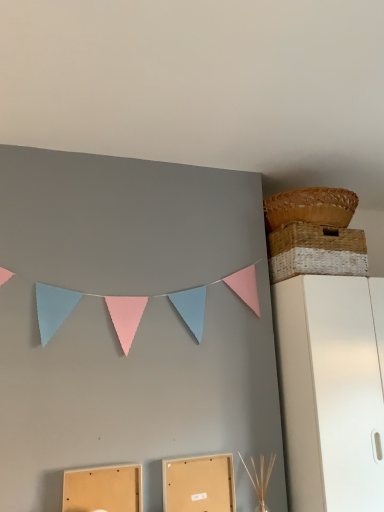
What do you see at coordinates (331, 390) in the screenshot?
I see `white matte cabinet at right` at bounding box center [331, 390].

This screenshot has height=512, width=384. Describe the element at coordinates (310, 207) in the screenshot. I see `woven brown basket at upper right, which appears as the first basket when viewed from the top` at that location.

Describe the element at coordinates (316, 251) in the screenshot. The width and height of the screenshot is (384, 512). I see `woven natural basket at upper right, the 2th basket when ordered from top to bottom` at that location.

At what (x,y) coordinates should I click in order to perform the action: click on white matte cabinet at right. Please return your answer as a coordinate pair (x, y). Looking at the image, I should click on (331, 390).

From a real-world perspective, is woven natural basket at upper right, the 2th basket when ordered from top to bottom, on top of matte cardboard box at lower center, which is the 1th cardboard box in left-to-right order?

Indeed, from a real-world perspective, woven natural basket at upper right, the 2th basket when ordered from top to bottom, stands above matte cardboard box at lower center, which is the 1th cardboard box in left-to-right order.

In terms of width, does woven natural basket at upper right, which is counted as the 1th basket, starting from the bottom, look wider or thinner when compared to matte cardboard box at lower center, the 2th cardboard box viewed from the right?

Considering their sizes, woven natural basket at upper right, which is counted as the 1th basket, starting from the bottom, looks broader than matte cardboard box at lower center, the 2th cardboard box viewed from the right.

The height and width of the screenshot is (512, 384). Identify the location of cardboard box that is the 2nd one when counting forward from the woven natural basket at upper right, which is counted as the 1th basket, starting from the bottom. (103, 489).

From the image's perspective, who appears lower, woven natural basket at upper right, the 2th basket when ordered from top to bottom, or matte cardboard box at lower center, the 2th cardboard box viewed from the right?

From the image's view, matte cardboard box at lower center, the 2th cardboard box viewed from the right, is below.

Where is `cardboard box that appears on the right of matte cardboard box at lower center, which is the 1th cardboard box in left-to-right order`? The image size is (384, 512). cardboard box that appears on the right of matte cardboard box at lower center, which is the 1th cardboard box in left-to-right order is located at coordinates (199, 484).

Which is more to the left, matte cardboard box at lower center, the 2th cardboard box viewed from the right, or matte cardboard box at lower center, positioned as the first cardboard box in right-to-left order?

Positioned to the left is matte cardboard box at lower center, the 2th cardboard box viewed from the right.

Is matte cardboard box at lower center, which is the 1th cardboard box in left-to-right order, next to matte cardboard box at lower center, positioned as the first cardboard box in right-to-left order, and touching it?

No, matte cardboard box at lower center, which is the 1th cardboard box in left-to-right order, is not with matte cardboard box at lower center, positioned as the first cardboard box in right-to-left order.

From a real-world perspective, is matte cardboard box at lower center, which is the 1th cardboard box in left-to-right order, on matte cardboard box at lower center, positioned as the second cardboard box in left-to-right order?

No.

From the picture: Is woven natural basket at upper right, which is counted as the 1th basket, starting from the bottom, turned away from matte cardboard box at lower center, positioned as the second cardboard box in left-to-right order?

No, woven natural basket at upper right, which is counted as the 1th basket, starting from the bottom, is not facing the opposite direction of matte cardboard box at lower center, positioned as the second cardboard box in left-to-right order.

Which object is thinner, woven natural basket at upper right, which is counted as the 1th basket, starting from the bottom, or matte cardboard box at lower center, positioned as the second cardboard box in left-to-right order?

matte cardboard box at lower center, positioned as the second cardboard box in left-to-right order.

Would you say woven natural basket at upper right, the 2th basket when ordered from top to bottom, contains matte cardboard box at lower center, positioned as the first cardboard box in right-to-left order?

Definitely not — matte cardboard box at lower center, positioned as the first cardboard box in right-to-left order, is not inside woven natural basket at upper right, the 2th basket when ordered from top to bottom.

Can you confirm if woven natural basket at upper right, which is counted as the 1th basket, starting from the bottom, is bigger than matte cardboard box at lower center, positioned as the second cardboard box in left-to-right order?

Yes, woven natural basket at upper right, which is counted as the 1th basket, starting from the bottom, is bigger than matte cardboard box at lower center, positioned as the second cardboard box in left-to-right order.

Is woven brown basket at upper right, which appears as the 2th basket when ordered from the bottom, oriented towards matte cardboard box at lower center, which is the 1th cardboard box in left-to-right order?

No, woven brown basket at upper right, which appears as the 2th basket when ordered from the bottom, is not facing towards matte cardboard box at lower center, which is the 1th cardboard box in left-to-right order.

Does point (311, 219) appear closer or farther from the camera than point (131, 473)?

Point (311, 219).

How different are the orientations of woven brown basket at upper right, which appears as the 2th basket when ordered from the bottom, and matte cardboard box at lower center, the 2th cardboard box viewed from the right, in degrees?

The angle between the facing direction of woven brown basket at upper right, which appears as the 2th basket when ordered from the bottom, and the facing direction of matte cardboard box at lower center, the 2th cardboard box viewed from the right, is 0.829 degrees.

Can matte cardboard box at lower center, which is the 1th cardboard box in left-to-right order, be found inside woven brown basket at upper right, which appears as the first basket when viewed from the top?

No, matte cardboard box at lower center, which is the 1th cardboard box in left-to-right order, is located outside of woven brown basket at upper right, which appears as the first basket when viewed from the top.

Considering the relative sizes of matte cardboard box at lower center, positioned as the second cardboard box in left-to-right order, and woven natural basket at upper right, the 2th basket when ordered from top to bottom, in the image provided, is matte cardboard box at lower center, positioned as the second cardboard box in left-to-right order, bigger than woven natural basket at upper right, the 2th basket when ordered from top to bottom,?

No.

Is matte cardboard box at lower center, positioned as the first cardboard box in right-to-left order, shorter than woven natural basket at upper right, which is counted as the 1th basket, starting from the bottom?

No.

Is matte cardboard box at lower center, positioned as the first cardboard box in right-to-left order, thinner than woven natural basket at upper right, which is counted as the 1th basket, starting from the bottom?

Yes.

Measure the distance between matte cardboard box at lower center, positioned as the second cardboard box in left-to-right order, and woven natural basket at upper right, which is counted as the 1th basket, starting from the bottom.

matte cardboard box at lower center, positioned as the second cardboard box in left-to-right order, and woven natural basket at upper right, which is counted as the 1th basket, starting from the bottom, are 33.90 inches apart.

How different are the orientations of woven brown basket at upper right, which appears as the 2th basket when ordered from the bottom, and woven natural basket at upper right, the 2th basket when ordered from top to bottom, in degrees?

The angular difference between woven brown basket at upper right, which appears as the 2th basket when ordered from the bottom, and woven natural basket at upper right, the 2th basket when ordered from top to bottom, is 6.12e-05 degrees.

Is woven brown basket at upper right, which appears as the 2th basket when ordered from the bottom, completely or partially outside of woven natural basket at upper right, which is counted as the 1th basket, starting from the bottom?

That's correct, woven brown basket at upper right, which appears as the 2th basket when ordered from the bottom, is outside of woven natural basket at upper right, which is counted as the 1th basket, starting from the bottom.

Identify the location of basket on the right side of woven brown basket at upper right, which appears as the first basket when viewed from the top. The width and height of the screenshot is (384, 512). (316, 251).

Considering the relative sizes of white matte cabinet at right and woven natural basket at upper right, the 2th basket when ordered from top to bottom, in the image provided, is white matte cabinet at right wider than woven natural basket at upper right, the 2th basket when ordered from top to bottom,?

Correct, the width of white matte cabinet at right exceeds that of woven natural basket at upper right, the 2th basket when ordered from top to bottom.

From the image's perspective, between white matte cabinet at right and woven natural basket at upper right, the 2th basket when ordered from top to bottom, which one is located above?

woven natural basket at upper right, the 2th basket when ordered from top to bottom.

Is white matte cabinet at right far away from woven natural basket at upper right, the 2th basket when ordered from top to bottom?

No, there isn't a large distance between white matte cabinet at right and woven natural basket at upper right, the 2th basket when ordered from top to bottom.

There is a matte cardboard box at lower center, the 2th cardboard box viewed from the right. Where is `the 1st basket above it (from the image's perspective)`? the 1st basket above it (from the image's perspective) is located at coordinates (316, 251).

I want to click on cardboard box below the matte cardboard box at lower center, positioned as the first cardboard box in right-to-left order (from a real-world perspective), so click(x=103, y=489).

Looking at the image, which one is located closer to matte cardboard box at lower center, positioned as the first cardboard box in right-to-left order, matte cardboard box at lower center, which is the 1th cardboard box in left-to-right order, or woven natural basket at upper right, which is counted as the 1th basket, starting from the bottom?

Based on the image, matte cardboard box at lower center, which is the 1th cardboard box in left-to-right order, appears to be nearer to matte cardboard box at lower center, positioned as the first cardboard box in right-to-left order.

Which object lies nearer to the anchor point matte cardboard box at lower center, the 2th cardboard box viewed from the right, woven natural basket at upper right, which is counted as the 1th basket, starting from the bottom, or matte cardboard box at lower center, positioned as the second cardboard box in left-to-right order?

matte cardboard box at lower center, positioned as the second cardboard box in left-to-right order, lies closer to matte cardboard box at lower center, the 2th cardboard box viewed from the right, than the other object.

From the image, which object appears to be nearer to white matte cabinet at right, matte cardboard box at lower center, the 2th cardboard box viewed from the right, or woven brown basket at upper right, which appears as the first basket when viewed from the top?

Among the two, woven brown basket at upper right, which appears as the first basket when viewed from the top, is located nearer to white matte cabinet at right.

Considering their positions, is white matte cabinet at right positioned closer to woven brown basket at upper right, which appears as the first basket when viewed from the top, than matte cardboard box at lower center, positioned as the first cardboard box in right-to-left order?

white matte cabinet at right lies closer to woven brown basket at upper right, which appears as the first basket when viewed from the top, than the other object.

Looking at this image, from the image, which object appears to be farther from woven brown basket at upper right, which appears as the 2th basket when ordered from the bottom, matte cardboard box at lower center, positioned as the second cardboard box in left-to-right order, or woven natural basket at upper right, which is counted as the 1th basket, starting from the bottom?

matte cardboard box at lower center, positioned as the second cardboard box in left-to-right order, is positioned further to the anchor woven brown basket at upper right, which appears as the 2th basket when ordered from the bottom.

Looking at the image, which one is located closer to white matte cabinet at right, matte cardboard box at lower center, the 2th cardboard box viewed from the right, or matte cardboard box at lower center, positioned as the second cardboard box in left-to-right order?

matte cardboard box at lower center, positioned as the second cardboard box in left-to-right order.

When comparing their distances from woven natural basket at upper right, which is counted as the 1th basket, starting from the bottom, does matte cardboard box at lower center, positioned as the second cardboard box in left-to-right order, or white matte cabinet at right seem closer?

white matte cabinet at right is closer to woven natural basket at upper right, which is counted as the 1th basket, starting from the bottom.

Which object lies nearer to the anchor point matte cardboard box at lower center, the 2th cardboard box viewed from the right, woven natural basket at upper right, which is counted as the 1th basket, starting from the bottom, or woven brown basket at upper right, which appears as the 2th basket when ordered from the bottom?

woven natural basket at upper right, which is counted as the 1th basket, starting from the bottom, is closer to matte cardboard box at lower center, the 2th cardboard box viewed from the right.

At what (x,y) coordinates should I click in order to perform the action: click on basket between woven brown basket at upper right, which appears as the first basket when viewed from the top, and matte cardboard box at lower center, which is the 1th cardboard box in left-to-right order, in the vertical direction. Please return your answer as a coordinate pair (x, y). The height and width of the screenshot is (512, 384). Looking at the image, I should click on (316, 251).

Identify the location of cardboard box between matte cardboard box at lower center, the 2th cardboard box viewed from the right, and white matte cabinet at right. The image size is (384, 512). (199, 484).

Where is `cardboard box between woven natural basket at upper right, which is counted as the 1th basket, starting from the bottom, and matte cardboard box at lower center, positioned as the first cardboard box in right-to-left order, from top to bottom`? The image size is (384, 512). cardboard box between woven natural basket at upper right, which is counted as the 1th basket, starting from the bottom, and matte cardboard box at lower center, positioned as the first cardboard box in right-to-left order, from top to bottom is located at coordinates (103, 489).

Identify the location of basket that lies between woven brown basket at upper right, which appears as the first basket when viewed from the top, and matte cardboard box at lower center, positioned as the second cardboard box in left-to-right order, from top to bottom. This screenshot has height=512, width=384. (316, 251).